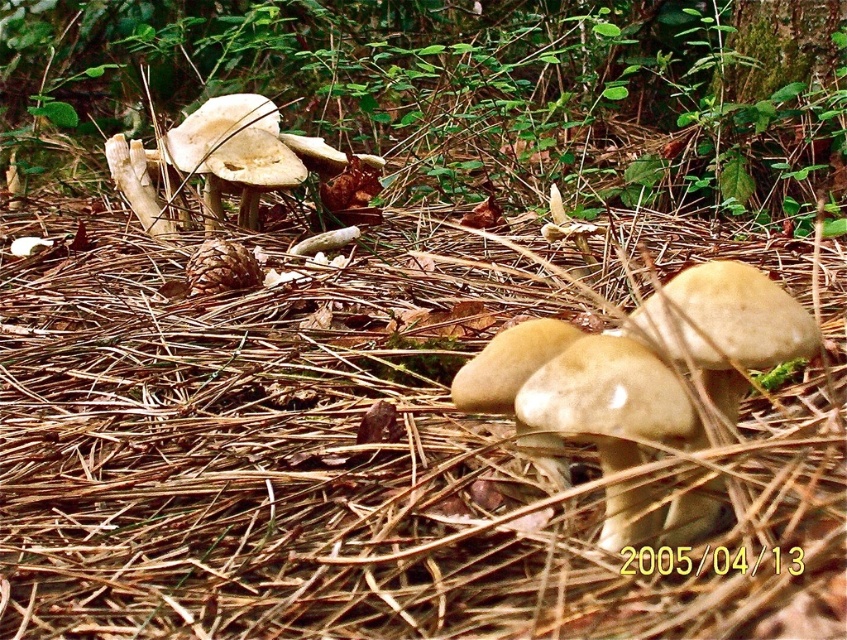
Who is more forward, (x=47, y=141) or (x=577, y=385)?

Point (x=577, y=385) is more forward.

Which is behind, point (457, 90) or point (665, 387)?

Point (457, 90)

Between point (596, 99) and point (637, 349), which one is positioned in front?

Point (637, 349)

Where is `white matte mushrooms at center`? This screenshot has height=640, width=847. white matte mushrooms at center is located at coordinates tap(464, 84).